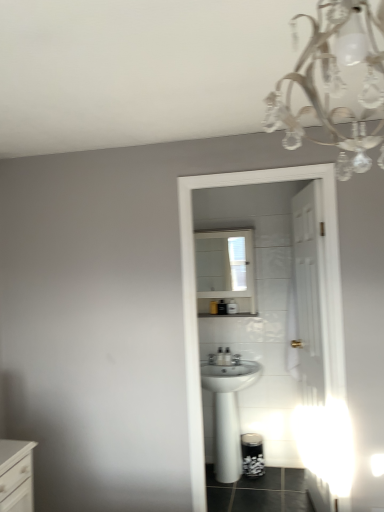
Question: Choose the correct answer: Is white glossy medicine cabinet at center inside white glossy chest of drawers at lower left or outside it?

Choices:
 (A) outside
 (B) inside

Answer: (A)

Question: Considering the positions of point (243, 301) and point (29, 455), is point (243, 301) closer or farther from the camera than point (29, 455)?

Choices:
 (A) farther
 (B) closer

Answer: (A)

Question: Estimate the real-world distances between objects in this image. Which object is farther from the white glossy chest of drawers at lower left?

Choices:
 (A) white glossy sink at center
 (B) clear crystal chandelier at upper right
 (C) white glossy medicine cabinet at center

Answer: (C)

Question: Estimate the real-world distances between objects in this image. Which object is farther from the white glossy chest of drawers at lower left?

Choices:
 (A) white glossy medicine cabinet at center
 (B) clear crystal chandelier at upper right
 (C) white glossy sink at center

Answer: (A)